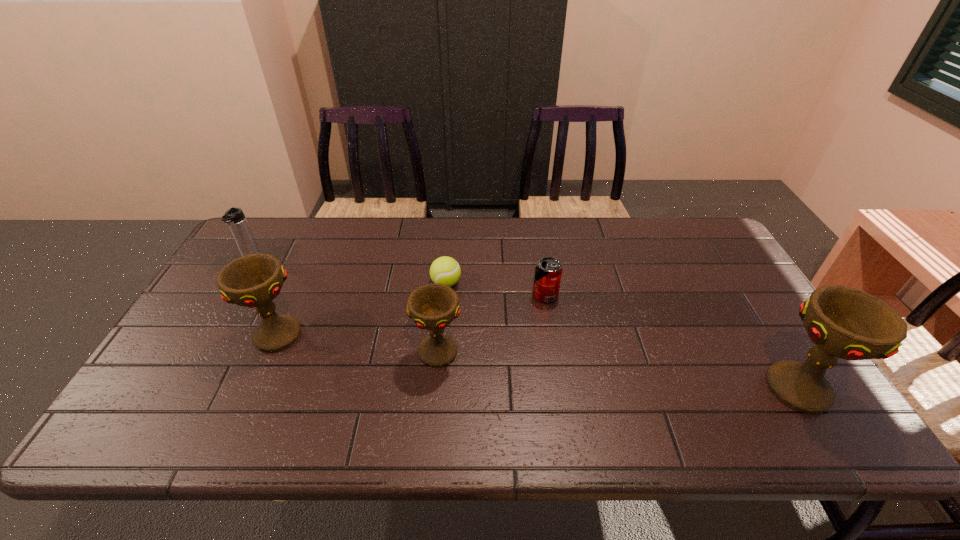
Locate an element on the screen. Image resolution: width=960 pixels, height=540 pixels. location for an additional chalice to make spacing equal is located at coordinates (612, 369).